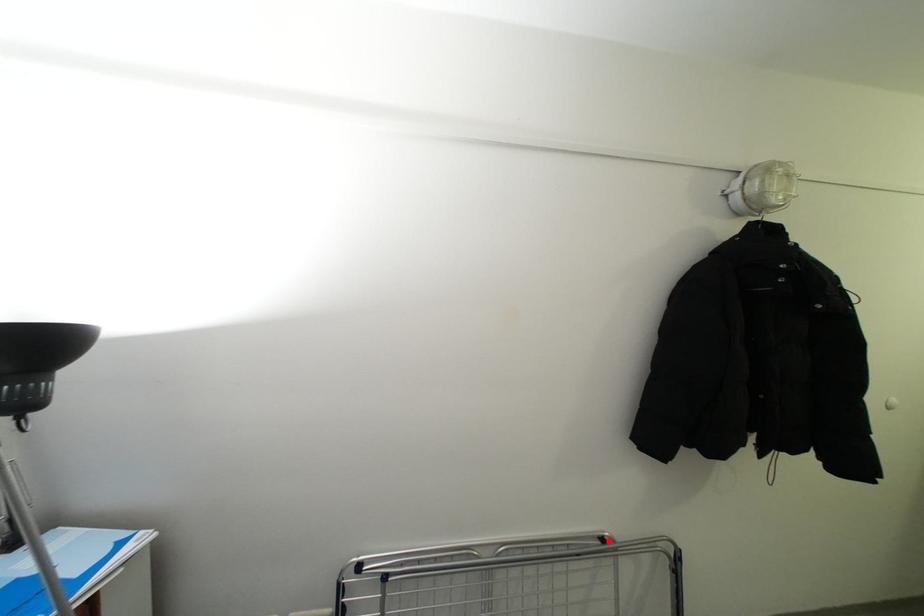
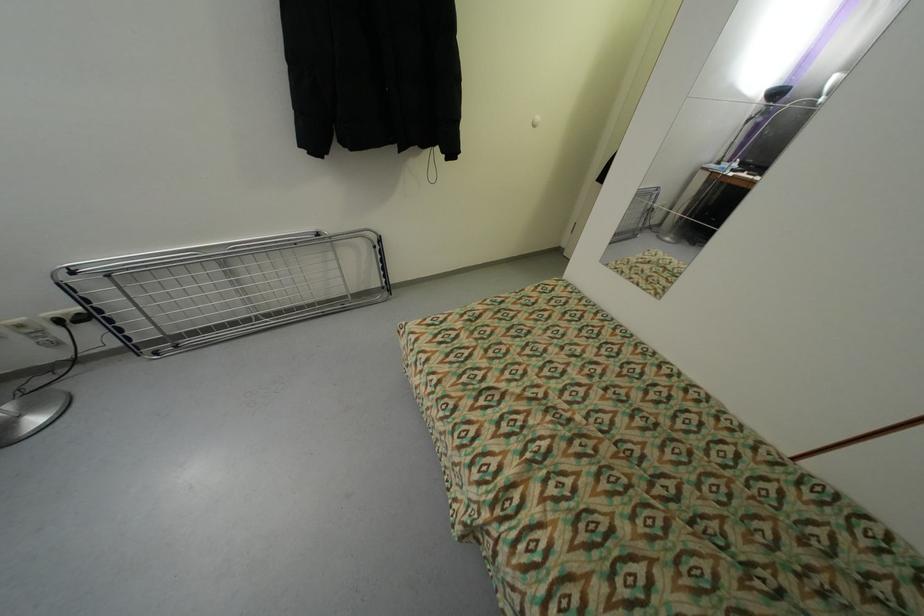
Question: I am providing you with two images of the same scene from different viewpoints. Given a red point in image1, look at the same physical point in image2. Is it:

Choices:
 (A) Closer to the viewpoint
 (B) Farther from the viewpoint

Answer: (A)